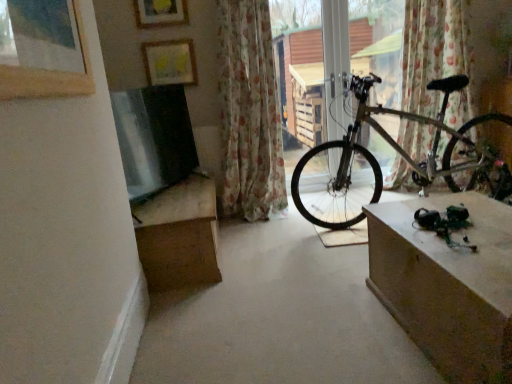
Question: From the image's perspective, is concretesmoothconcrete at center above or below matte brown table at right?

Choices:
 (A) above
 (B) below

Answer: (A)

Question: Considering the positions of concretesmoothconcrete at center and matte brown table at right in the image, is concretesmoothconcrete at center wider or thinner than matte brown table at right?

Choices:
 (A) thin
 (B) wide

Answer: (B)

Question: Which is nearer to the wooden picture frame at upper left, the 3th picture frame when ordered from top to bottom?

Choices:
 (A) floral fabric curtain at center, the 1th curtain in the left-to-right sequence
 (B) matte yellow picture frame at upper center, the second picture frame from the top
 (C) concretesmoothconcrete at center
 (D) brown cardboard box at lower left
 (E) metallic bicycle at center

Answer: (D)

Question: Considering the real-world distances, which object is closest to the wooden picture frame at upper left, the first picture frame positioned from the front?

Choices:
 (A) matte brown table at right
 (B) matte yellow picture frame at upper center, acting as the second picture frame starting from the bottom
 (C) brown cardboard box at lower left
 (D) metallic bicycle at center
 (E) metallic silver bicycle at center

Answer: (C)